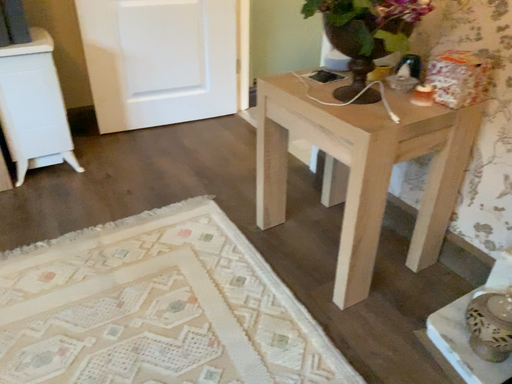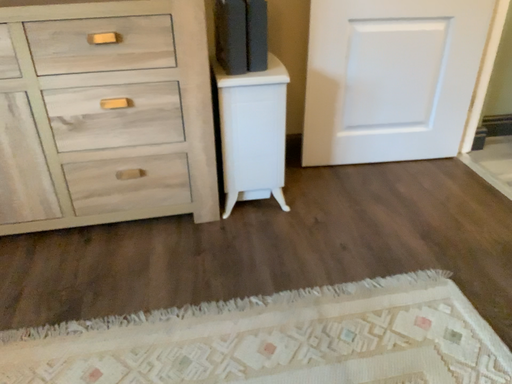
Question: How did the camera likely rotate when shooting the video?

Choices:
 (A) rotated right
 (B) rotated left

Answer: (B)